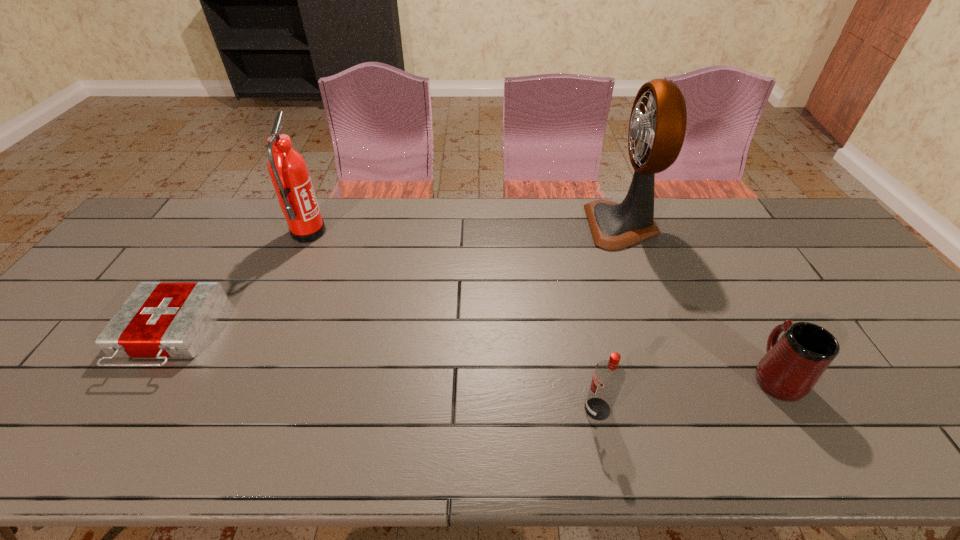
Image resolution: width=960 pixels, height=540 pixels. I want to click on empty location between the mug and the shortest object, so click(471, 355).

At what (x,y) coordinates should I click in order to perform the action: click on vacant point located between the vodka and the tallest object. Please return your answer as a coordinate pair (x, y). The height and width of the screenshot is (540, 960). Looking at the image, I should click on (610, 317).

Where is `unoccupied area between the fourth object from left to right and the mug`? unoccupied area between the fourth object from left to right and the mug is located at coordinates (699, 300).

The width and height of the screenshot is (960, 540). I want to click on free point between the second object from left to right and the first-aid kit, so click(238, 284).

Where is `unoccupied position between the fourth object from left to right and the mug`? The image size is (960, 540). unoccupied position between the fourth object from left to right and the mug is located at coordinates (699, 300).

This screenshot has height=540, width=960. I want to click on object that stands as the fourth closest to the second object from right to left, so click(161, 320).

Find the location of a particular element. This screenshot has width=960, height=540. object that stands as the fourth closest to the first-aid kit is located at coordinates (792, 365).

Where is `vacant space that satisfies the following two spatial constraints: 1. on the label side of the fire extinguisher; 2. on the front side of the leftmost object`? This screenshot has height=540, width=960. vacant space that satisfies the following two spatial constraints: 1. on the label side of the fire extinguisher; 2. on the front side of the leftmost object is located at coordinates (262, 335).

Image resolution: width=960 pixels, height=540 pixels. Find the location of `free location that satisfies the following two spatial constraints: 1. on the side of the second shortest object with the handle; 2. on the label side of the fourth shortest object`. free location that satisfies the following two spatial constraints: 1. on the side of the second shortest object with the handle; 2. on the label side of the fourth shortest object is located at coordinates (695, 233).

The image size is (960, 540). I want to click on blank space that satisfies the following two spatial constraints: 1. on the side of the rightmost object with the handle; 2. on the front-facing side of the fan, so click(691, 226).